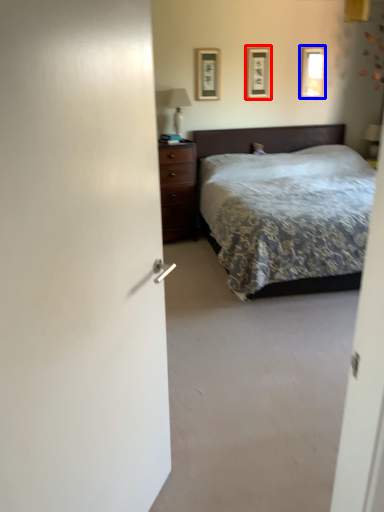
Question: Which object is closer to the camera taking this photo, picture frame (highlighted by a red box) or picture frame (highlighted by a blue box)?

Choices:
 (A) picture frame
 (B) picture frame

Answer: (A)